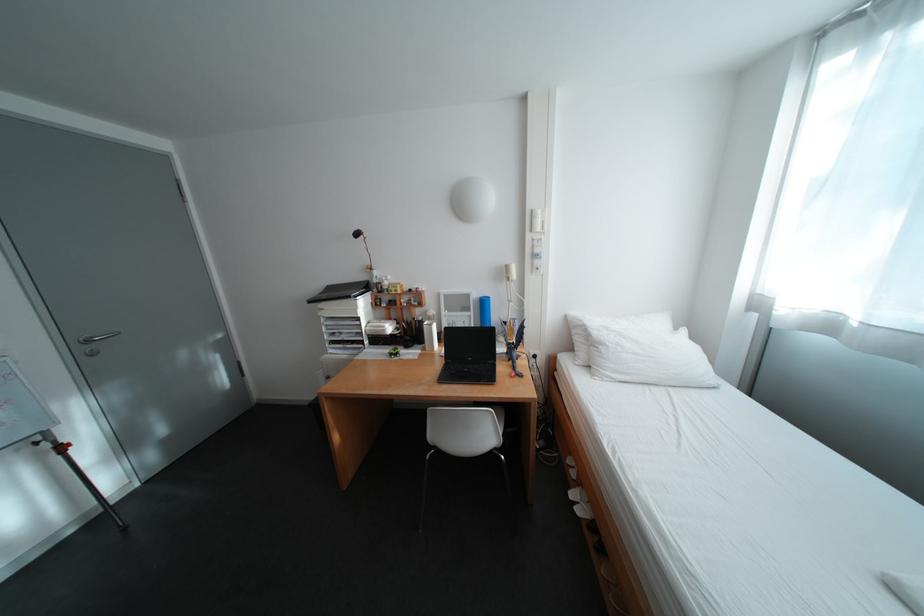
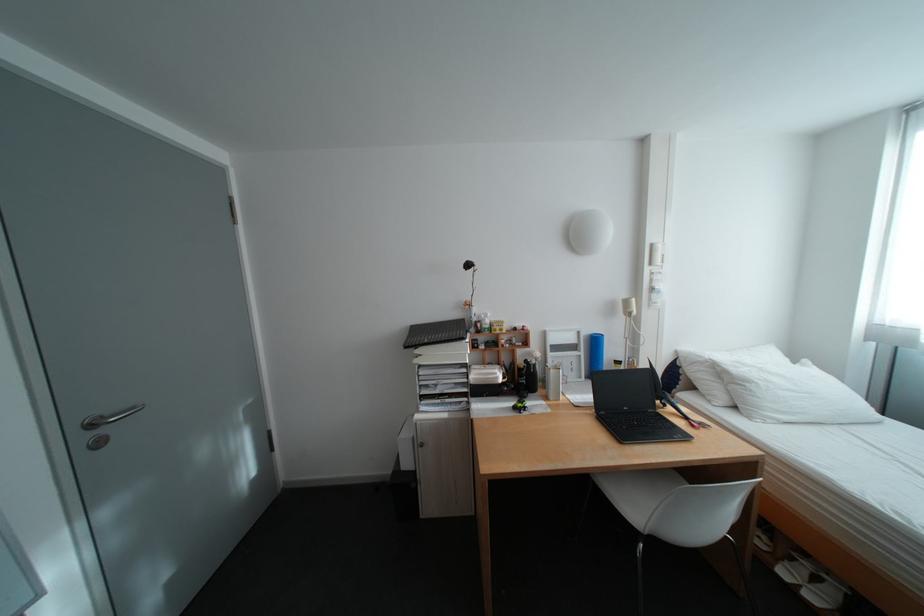
Locate, in the second image, the point that corresponds to point 614,346 in the first image.

(761, 384)